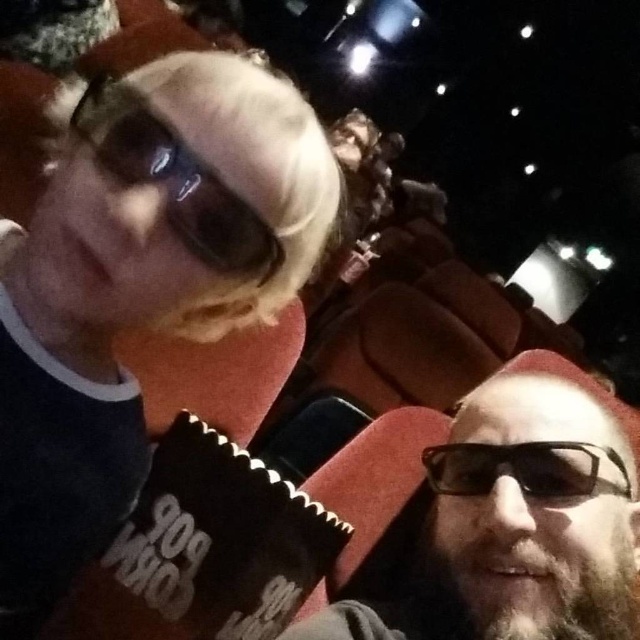
You are standing in the audience at the concert and want to hand a flower to the person with the matte black beard at lower right. The flower is in your hand, and you need to reach them. Considering you can stretch your arm 60 centimeters forward, will you be able to reach them?

The distance between you and the matte black beard at lower right is 59.23 centimeters, which is slightly less than your arm stretch of 60 centimeters. Therefore, you can reach them to hand the flower.

Consider the image. You are a photographer at the concert and need to capture a closeup shot of the person wearing the matte black sunglasses at upper left and the matte black goggles at upper left. Which object will appear larger in your photo?

The matte black sunglasses at upper left will appear larger in the photo because it is bigger than the matte black goggles at upper left.